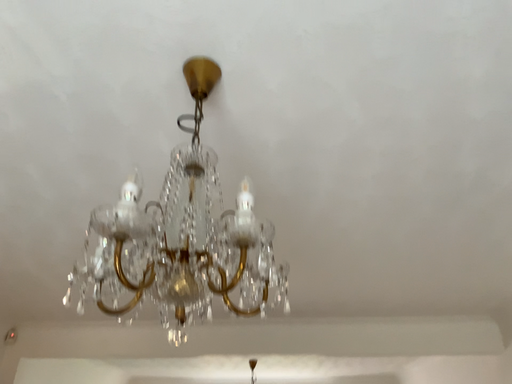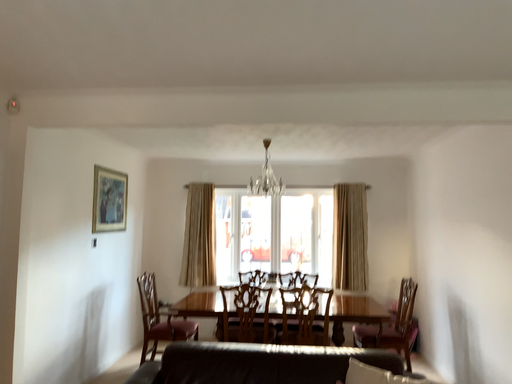
Question: Which way did the camera rotate in the video?

Choices:
 (A) rotated upward
 (B) rotated downward

Answer: (B)